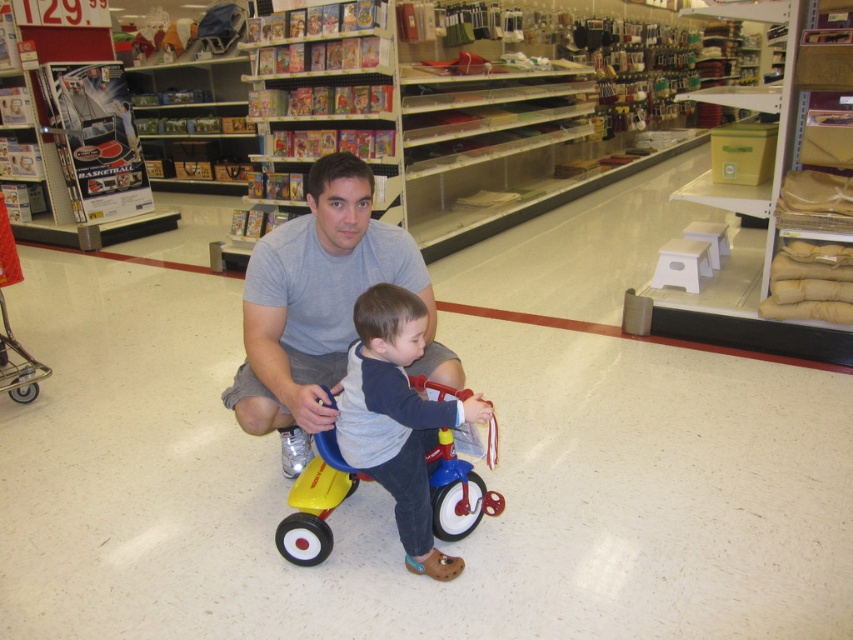
You are trying to decide between two gray shirts displayed at the center of a department store. The gray cotton shirt at center and the gray fleece shirt at center are both on the same rack. Which one would you choose if you want the wider option?

The gray cotton shirt at center has a larger width than the gray fleece shirt at center, so you should choose the gray cotton shirt at center.